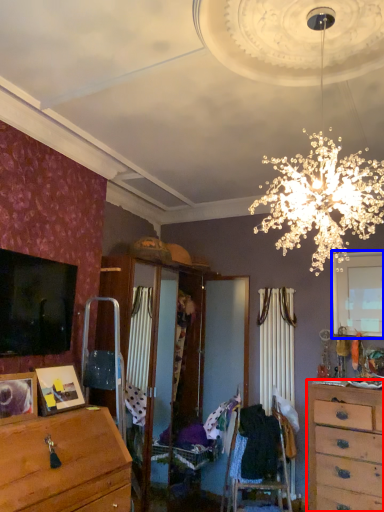
Question: Among these objects, which one is farthest to the camera, chest of drawers (highlighted by a red box) or window (highlighted by a blue box)?

Choices:
 (A) chest of drawers
 (B) window

Answer: (B)